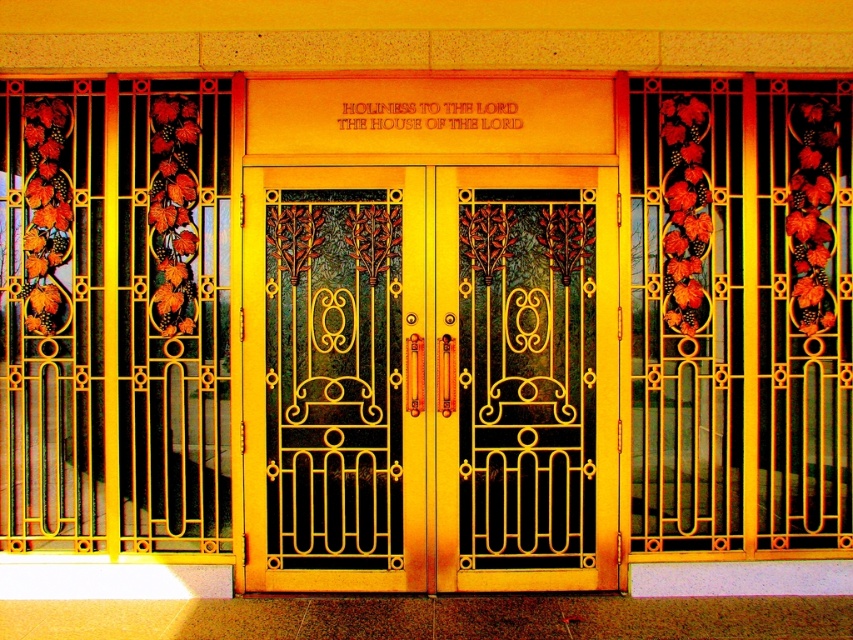
Based on the photo, can you confirm if gold polished metal doors at center is smaller than gold textured door at center?

No.

Does point (363, 364) come closer to viewer compared to point (572, 476)?

Yes, it is in front of point (572, 476).

Where is `gold polished metal doors at center`? gold polished metal doors at center is located at coordinates (430, 378).

Based on the photo, between gold textured screen door at center and gold textured door at center, which one is positioned higher?

gold textured door at center

Can you confirm if gold textured screen door at center is wider than gold textured door at center?

In fact, gold textured screen door at center might be narrower than gold textured door at center.

Locate an element on the screen. Image resolution: width=853 pixels, height=640 pixels. gold textured screen door at center is located at coordinates (334, 378).

Who is taller, gold polished metal doors at center or gold textured screen door at center?

Standing taller between the two is gold textured screen door at center.

Does gold polished metal doors at center have a greater height compared to gold textured screen door at center?

No, gold polished metal doors at center is not taller than gold textured screen door at center.

Measure the distance between gold polished metal doors at center and camera.

The distance of gold polished metal doors at center from camera is 5.30 meters.

Locate an element on the screen. The height and width of the screenshot is (640, 853). gold polished metal doors at center is located at coordinates (430, 378).